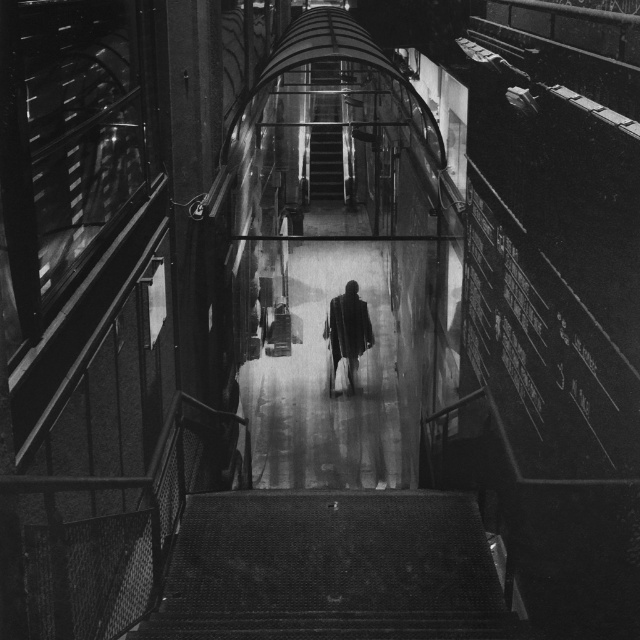
Can you confirm if metallic staircase at center is positioned below dark textured coat at center?

Actually, metallic staircase at center is above dark textured coat at center.

Which of these two, metallic staircase at center or dark textured coat at center, stands taller?

metallic staircase at center is taller.

You are a GUI agent. You are given a task and a screenshot of the screen. Output one action in this format:
    pyautogui.click(x=<x>, y=<y>)
    Task: Click on the metallic staircase at center
    
    Given the screenshot: What is the action you would take?
    click(x=324, y=132)

Is point (184, 636) positioned before point (323, 131)?

Yes, point (184, 636) is closer to viewer.

Does metallic mesh stairs at bottom have a smaller size compared to metallic staircase at center?

Yes, metallic mesh stairs at bottom is smaller than metallic staircase at center.

Is point (244, 513) positioned behind point (320, 188)?

That is False.

Find the location of a particular element. metallic mesh stairs at bottom is located at coordinates (330, 568).

Who is shorter, metallic mesh stairs at bottom or dark textured coat at center?

With less height is metallic mesh stairs at bottom.

Between point (160, 609) and point (340, 314), which one is positioned in front?

Point (160, 609)

Describe the element at coordinates (330, 568) in the screenshot. This screenshot has height=640, width=640. I see `metallic mesh stairs at bottom` at that location.

Find the location of a particular element. Image resolution: width=640 pixels, height=640 pixels. metallic mesh stairs at bottom is located at coordinates (330, 568).